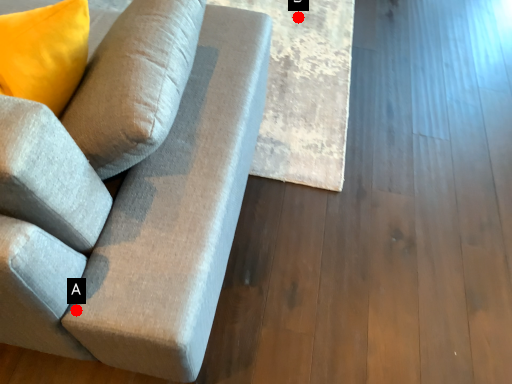
Question: Two points are circled on the image, labeled by A and B beside each circle. Which point is closer to the camera taking this photo?

Choices:
 (A) A is closer
 (B) B is closer

Answer: (A)